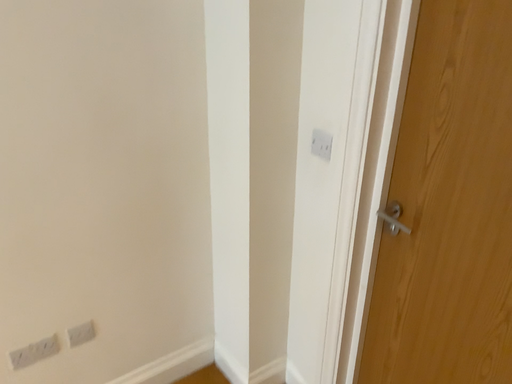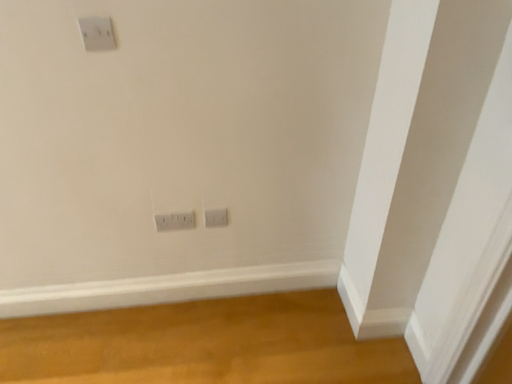
Question: Which way did the camera rotate in the video?

Choices:
 (A) rotated right
 (B) rotated left

Answer: (B)